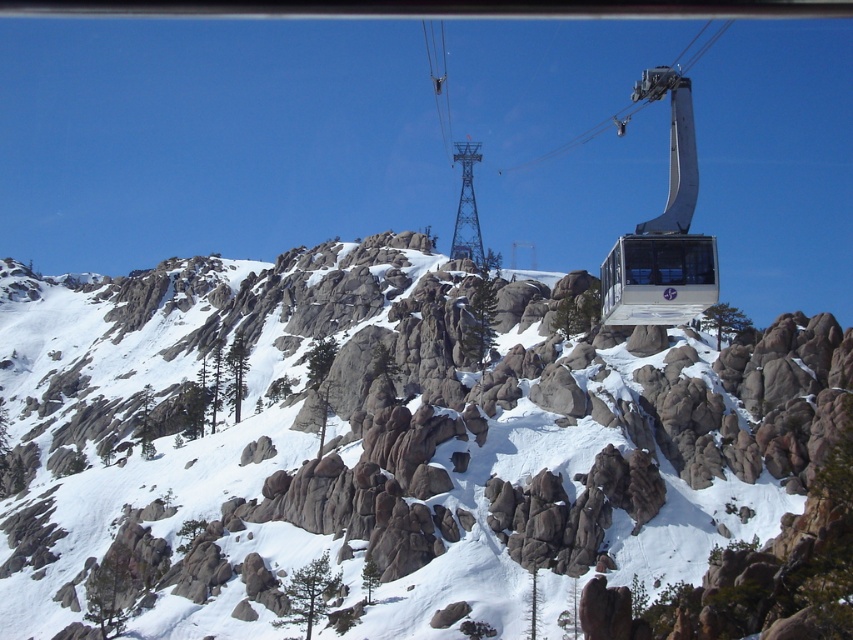
Question: Can you confirm if snowy granite mountain at center is bigger than metallic silver cable car at center?

Choices:
 (A) no
 (B) yes

Answer: (B)

Question: Does snowy granite mountain at center lie in front of metallic silver gondola at center?

Choices:
 (A) yes
 (B) no

Answer: (A)

Question: Which of the following is the farthest from the observer?

Choices:
 (A) snowy granite mountain at center
 (B) metallic silver gondola at center

Answer: (B)

Question: Does metallic silver gondola at center come behind metallic silver cable car at center?

Choices:
 (A) no
 (B) yes

Answer: (B)

Question: Which of the following is the closest to the observer?

Choices:
 (A) (621, 292)
 (B) (648, 308)
 (C) (410, 570)

Answer: (A)

Question: Based on their relative distances, which object is nearer to the metallic silver gondola at center?

Choices:
 (A) metallic silver cable car at center
 (B) snowy granite mountain at center

Answer: (A)